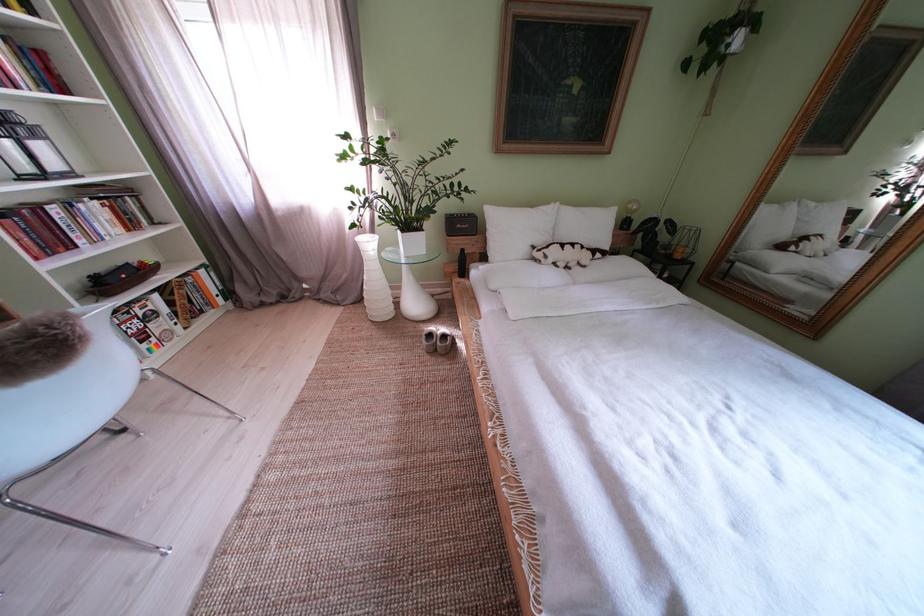
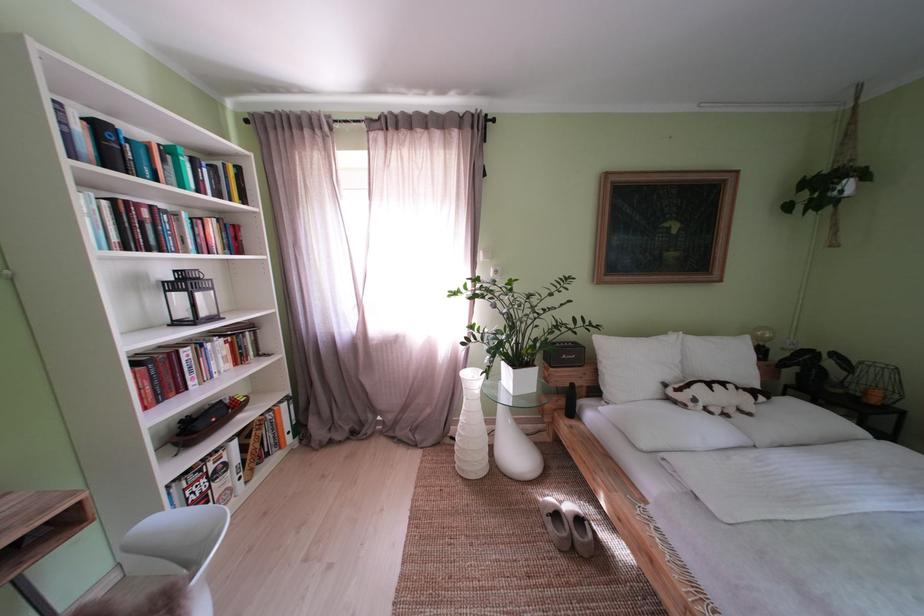
In the second image, find the point that corresponds to (x=442, y=341) in the first image.

(567, 521)